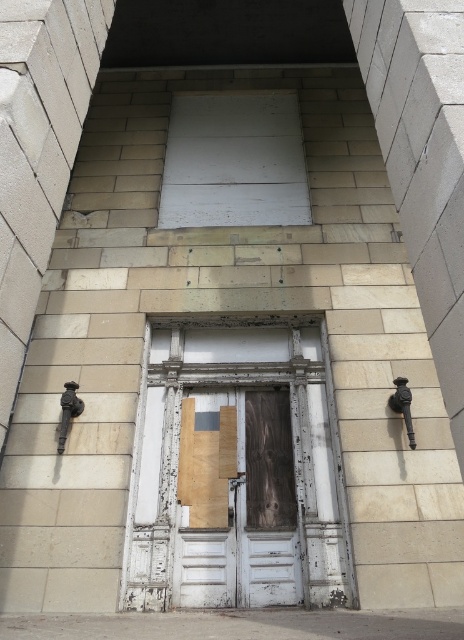
You are a painter hired to restore the facade of the old building. You need to know which object, the wooden door at center or the white matte board at upper center, requires more paint because of its larger size. Based on the scene description, which one should you prioritize?

The white matte board at upper center requires more paint because it has a greater width than the wooden door at center, as stated in the objects description.

You are a painter standing at the base of the building, holding a ladder that is 4 meters tall. You need to reach the white matte board at upper center to touch it up. Can you safely reach it using the ladder from the wooden door at center?

The distance between the wooden door at center and the white matte board at upper center is 4.38 meters. Since the ladder is only 4 meters tall, it is not tall enough to reach the white matte board at upper center from the wooden door at center.

You are a painter hired to restore the facade of the old building. You need to determine which object, the wooden door at center or the white matte board at upper center, requires more paint because it is taller. Based on the scene description, which one should you prioritize?

The wooden door at center is not as tall as the white matte board at upper center, so the white matte board at upper center requires more paint due to its greater height.